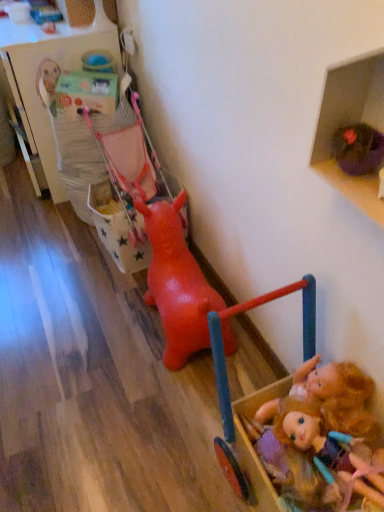
Question: Can you confirm if wooden dollhouse at lower right, arranged as the second toy when viewed from the back, is smaller than rubber pink baby carriage at center-left?

Choices:
 (A) no
 (B) yes

Answer: (A)

Question: Can you confirm if wooden dollhouse at lower right, which is the 1th toy from front to back, is positioned to the left of rubber pink baby carriage at center-left?

Choices:
 (A) yes
 (B) no

Answer: (B)

Question: Is rubber pink baby carriage at center-left a part of wooden dollhouse at lower right, which is the 1th toy from front to back?

Choices:
 (A) no
 (B) yes

Answer: (A)

Question: From a real-world perspective, is wooden dollhouse at lower right, arranged as the second toy when viewed from the back, positioned over rubber pink baby carriage at center-left based on gravity?

Choices:
 (A) yes
 (B) no

Answer: (A)

Question: Does wooden dollhouse at lower right, which is the 1th toy from front to back, come behind rubber pink baby carriage at center-left?

Choices:
 (A) no
 (B) yes

Answer: (A)

Question: Does wooden dollhouse at lower right, arranged as the second toy when viewed from the back, have a greater height compared to rubber pink baby carriage at center-left?

Choices:
 (A) yes
 (B) no

Answer: (A)

Question: Can you see wooden dollhouse at lower right, which is the 1th toy from front to back, touching plush blonde doll at lower right?

Choices:
 (A) yes
 (B) no

Answer: (A)

Question: Is wooden dollhouse at lower right, arranged as the second toy when viewed from the back, not inside plush blonde doll at lower right?

Choices:
 (A) yes
 (B) no

Answer: (A)

Question: Could you tell me if wooden dollhouse at lower right, which is the 1th toy from front to back, is facing plush blonde doll at lower right?

Choices:
 (A) no
 (B) yes

Answer: (B)

Question: Can you confirm if wooden dollhouse at lower right, which is the 1th toy from front to back, is positioned to the right of plush blonde doll at lower right?

Choices:
 (A) yes
 (B) no

Answer: (B)

Question: Is wooden dollhouse at lower right, which is the 1th toy from front to back, thinner than plush blonde doll at lower right?

Choices:
 (A) no
 (B) yes

Answer: (A)

Question: Is plush blonde doll at lower right a part of wooden dollhouse at lower right, arranged as the second toy when viewed from the back?

Choices:
 (A) yes
 (B) no

Answer: (A)

Question: Considering the relative sizes of wooden toy box at upper left, placed as the 1th shelf when sorted from back to front, and rubber dog at center, arranged as the 2th toy when viewed from the front, in the image provided, is wooden toy box at upper left, placed as the 1th shelf when sorted from back to front, shorter than rubber dog at center, arranged as the 2th toy when viewed from the front,?

Choices:
 (A) no
 (B) yes

Answer: (A)